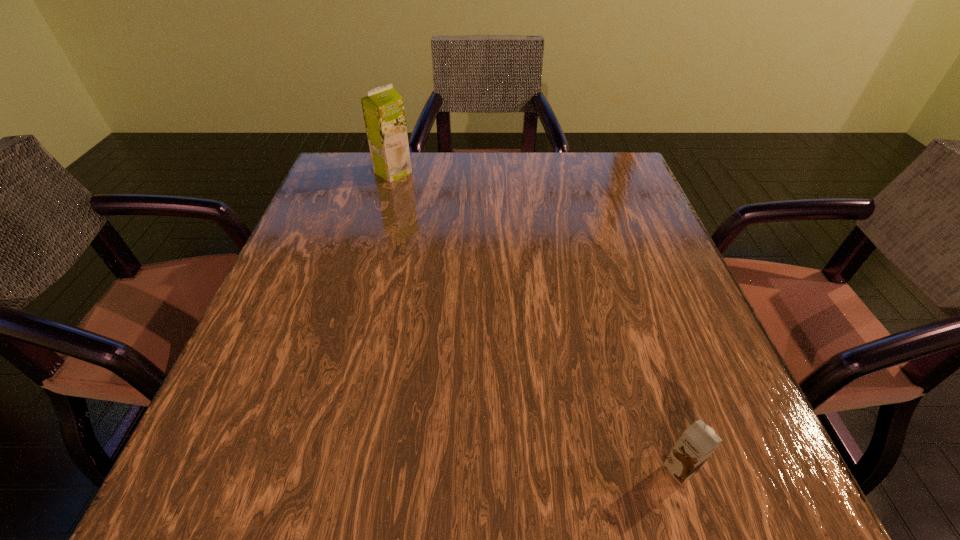
Where is `object present at the far left corner`? This screenshot has height=540, width=960. object present at the far left corner is located at coordinates (383, 109).

This screenshot has height=540, width=960. I want to click on object that is at the near right corner, so click(697, 443).

Identify the location of free space at the far edge of the desktop. (531, 191).

In the image, there is a desktop. At what (x,y) coordinates should I click in order to perform the action: click on vacant space at the near edge. Please return your answer as a coordinate pair (x, y). The height and width of the screenshot is (540, 960). Looking at the image, I should click on (642, 484).

Locate an element on the screen. The image size is (960, 540). vacant space at the left edge of the desktop is located at coordinates (338, 295).

This screenshot has height=540, width=960. In order to click on vacant space at the right edge of the desktop in this screenshot , I will do `click(677, 402)`.

The image size is (960, 540). I want to click on vacant space at the far left corner of the desktop, so click(374, 182).

Identify the location of vacant space at the far right corner of the desktop. This screenshot has width=960, height=540. (619, 162).

This screenshot has height=540, width=960. In order to click on vacant space that satisfies the following two spatial constraints: 1. on the front side of the left object; 2. on the left side of the shorter object in this screenshot , I will do `click(313, 469)`.

Locate an element on the screen. free space that satisfies the following two spatial constraints: 1. on the front side of the taller object; 2. on the right side of the right object is located at coordinates (313, 469).